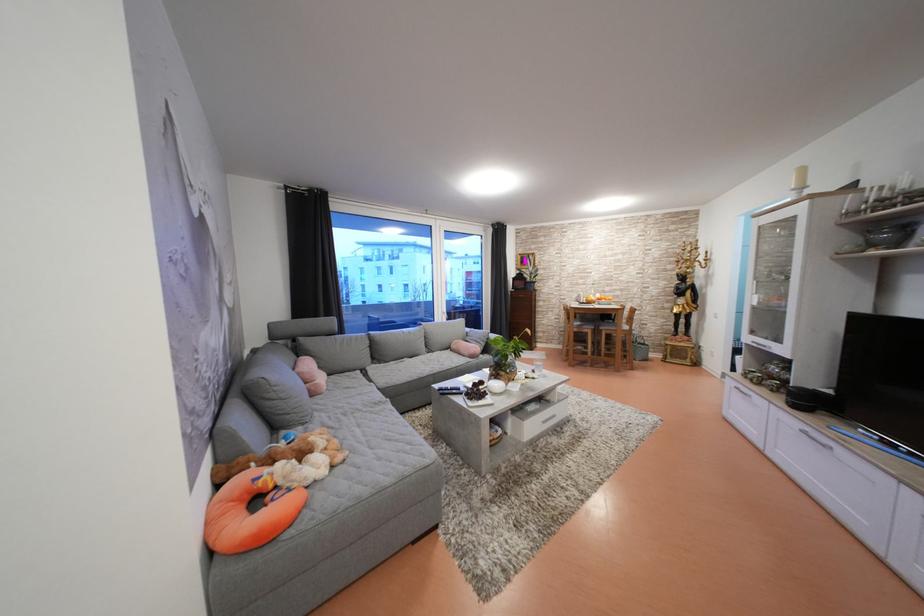
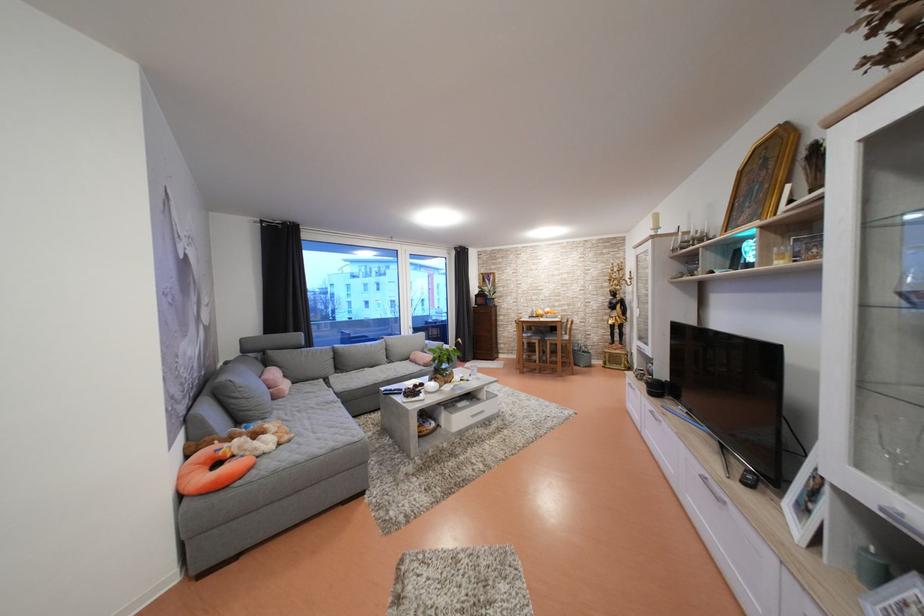
Find the pixel in the second image that matches pixel 246 505 in the first image.

(211, 469)